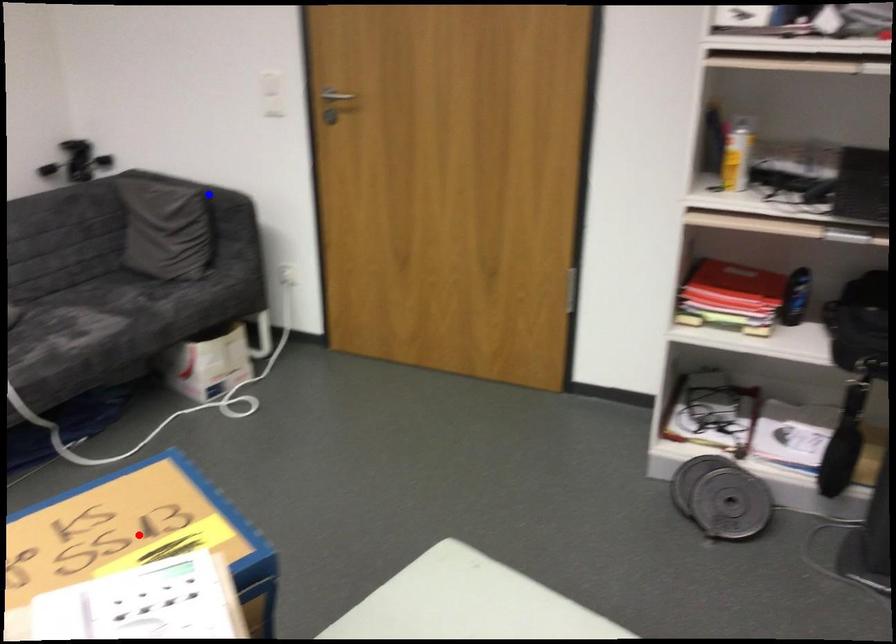
Question: Which of the two points in the image is closer to the camera?

Choices:
 (A) Blue point is closer.
 (B) Red point is closer.

Answer: (B)